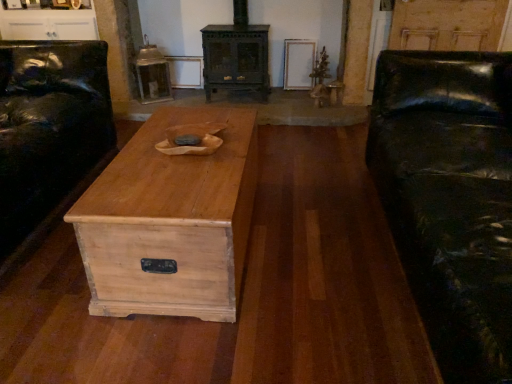
Locate an element on the screen. This screenshot has width=512, height=384. vacant space to the right of natural wood chest at center is located at coordinates [319, 244].